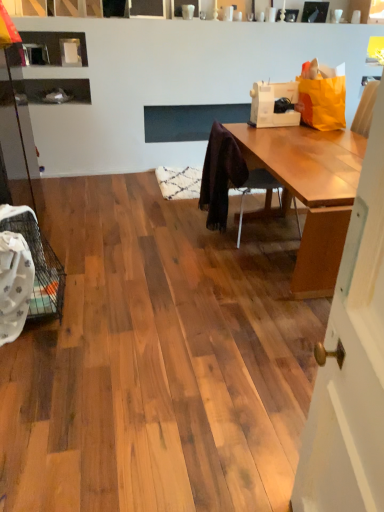
Identify the location of vacant region to the left of wooden chair at center. (178, 234).